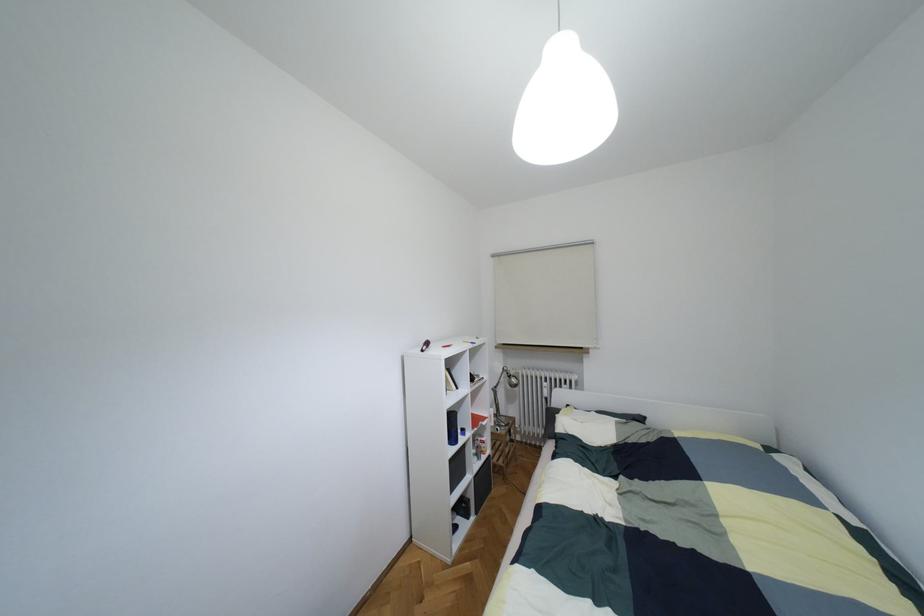
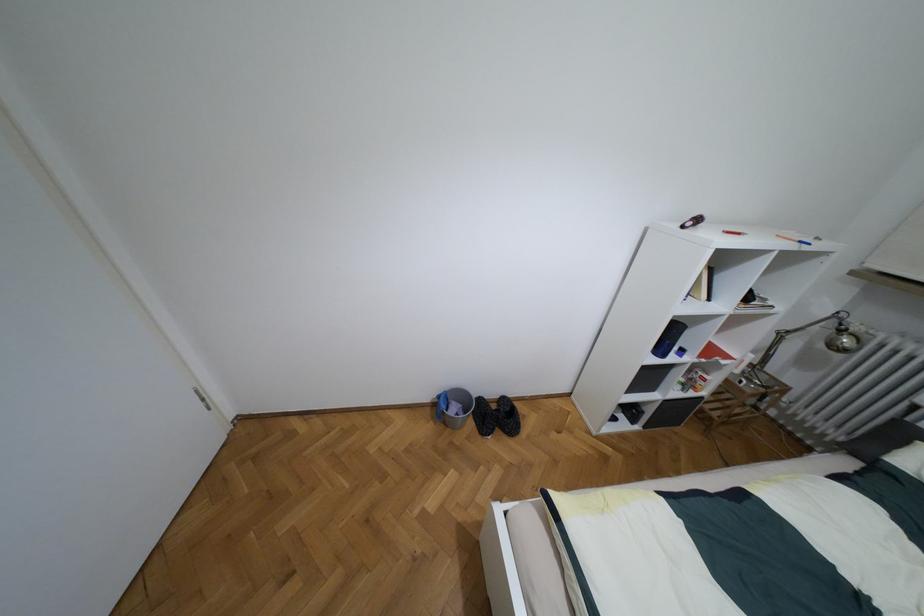
Find the pixel in the second image that matches (x=493, y=390) in the first image.

(781, 334)